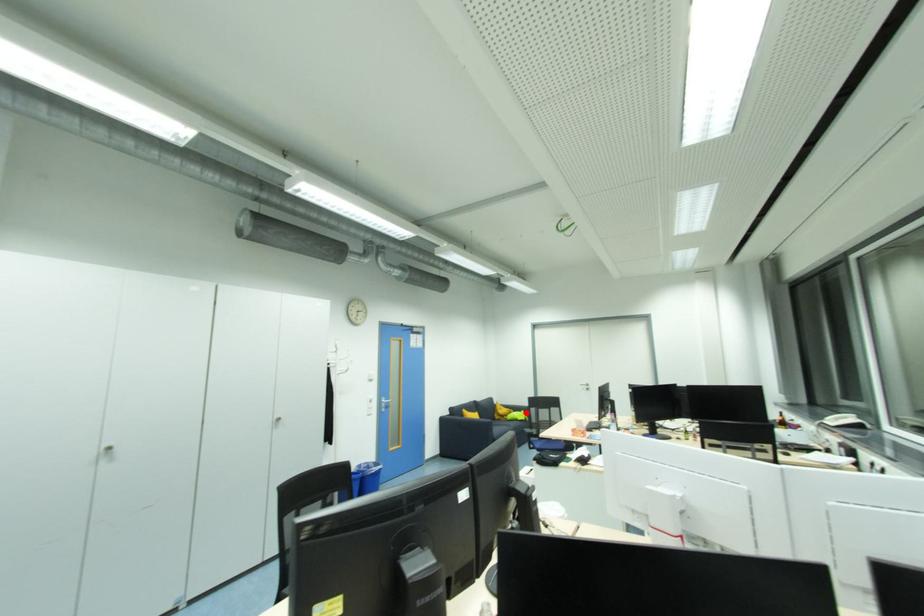
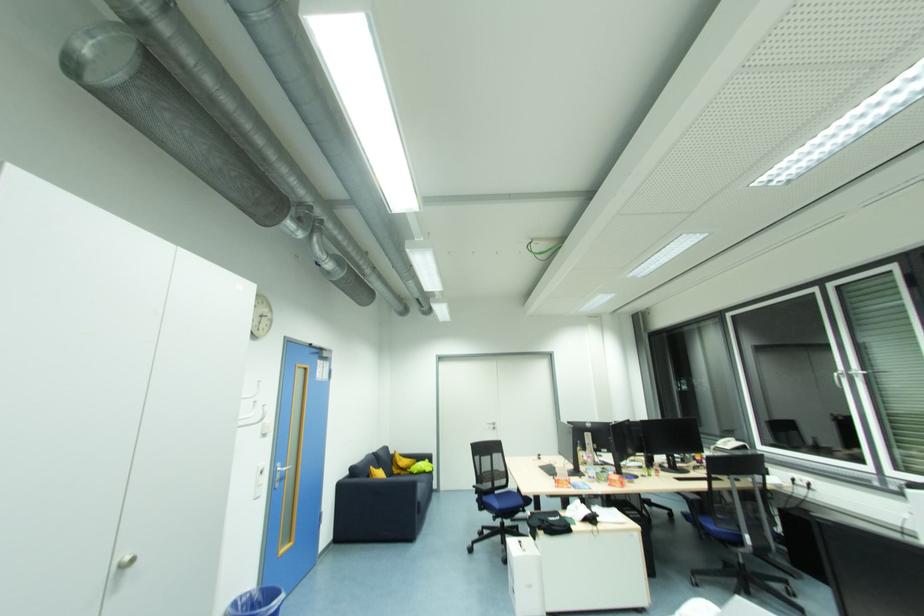
Question: I am providing you with two images of the same scene from different viewpoints. A red point is shown in image1. For the corresponding object point in image2, is it positioned nearer or farther from the camera?

Choices:
 (A) Nearer
 (B) Farther

Answer: (A)